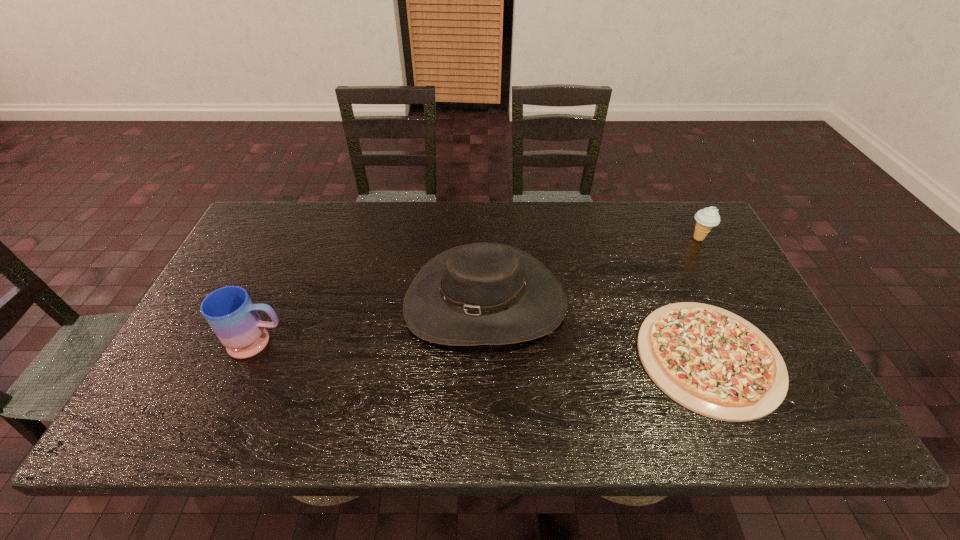
Image resolution: width=960 pixels, height=540 pixels. In order to click on cowboy hat in this screenshot , I will do `click(477, 294)`.

This screenshot has height=540, width=960. What are the coordinates of `the leftmost object` in the screenshot? It's located at (230, 312).

The height and width of the screenshot is (540, 960). Identify the location of the farthest object. (706, 218).

At what (x,y) coordinates should I click in order to perform the action: click on the third tallest object. Please return your answer as a coordinate pair (x, y). This screenshot has height=540, width=960. Looking at the image, I should click on (706, 218).

At what (x,y) coordinates should I click in order to perform the action: click on pizza. Please return your answer as a coordinate pair (x, y). Looking at the image, I should click on (711, 361).

You are a GUI agent. You are given a task and a screenshot of the screen. Output one action in this format:
    pyautogui.click(x=<x>, y=<y>)
    Task: Click on the free spot located on the front-facing side of the cowboy hat
    
    Given the screenshot: What is the action you would take?
    pyautogui.click(x=486, y=385)

You are a GUI agent. You are given a task and a screenshot of the screen. Output one action in this format:
    pyautogui.click(x=<x>, y=<y>)
    Task: Click on the free space located on the side of the mug with the handle
    This screenshot has width=960, height=540.
    Given the screenshot: What is the action you would take?
    pyautogui.click(x=425, y=342)

Identify the location of vacant space located on the front of the farthest object. (712, 264).

Image resolution: width=960 pixels, height=540 pixels. Find the location of `free space located 0.170m on the left of the pizza`. free space located 0.170m on the left of the pizza is located at coordinates (569, 357).

Locate an element on the screen. This screenshot has width=960, height=540. object that is at the far edge is located at coordinates (706, 218).